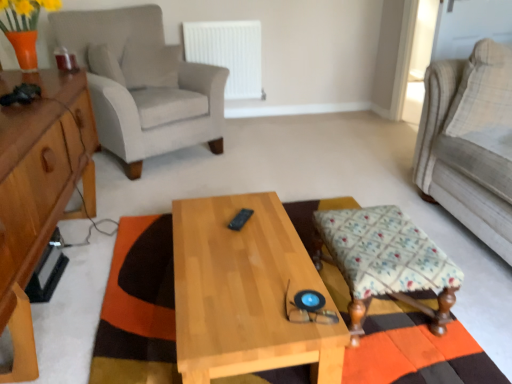
The width and height of the screenshot is (512, 384). What are the coordinates of `vacant area on top of white plastic radiator at upper center (from a real-world perspective)` in the screenshot? It's located at (223, 18).